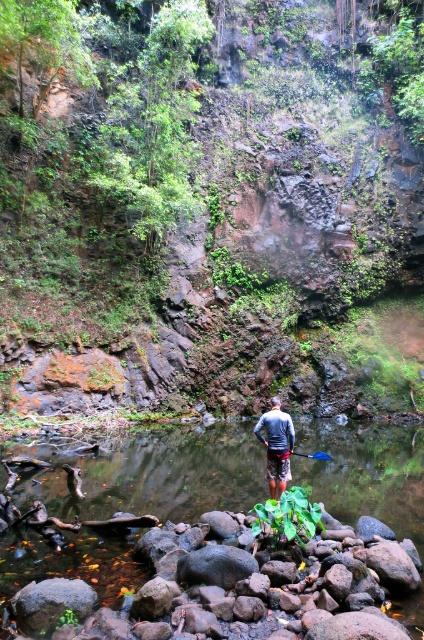
You are a hiker who wants to cross the smooth rock stream at center without getting your gray fabric shirt at center wet. Is the stream deeper than your waist height?

The smooth rock stream at center is taller than gray fabric shirt at center, so the stream is deeper than your waist height. You should avoid crossing here to keep your gray fabric shirt at center dry.

You are a hiker who wants to cross the smooth rock stream at center. You are currently standing on the gray fabric shirt at center. Which direction should you move to reach the stream?

The smooth rock stream at center is positioned on the left side of gray fabric shirt at center, so you should move to your left to reach the stream.